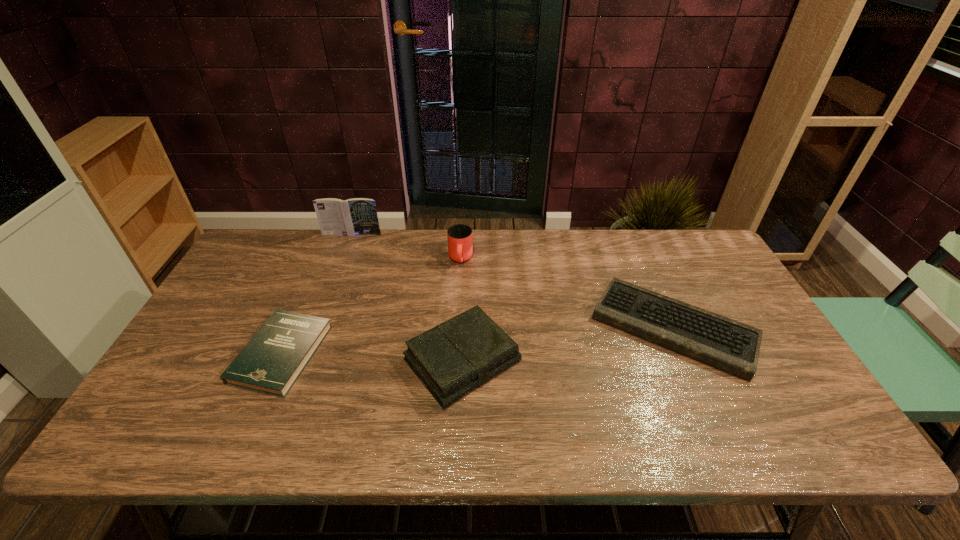
Locate an element on the screen. The width and height of the screenshot is (960, 540). vacant space at the left edge of the desktop is located at coordinates (228, 287).

The height and width of the screenshot is (540, 960). In order to click on free space at the right edge in this screenshot , I will do `click(707, 294)`.

This screenshot has width=960, height=540. Find the location of `vacant point at the far right corner`. vacant point at the far right corner is located at coordinates (713, 251).

Where is `vacant area that lies between the second farthest object and the third shortest object`? This screenshot has height=540, width=960. vacant area that lies between the second farthest object and the third shortest object is located at coordinates (462, 310).

At what (x,y) coordinates should I click in order to perform the action: click on free space between the cup and the shortest object. Please return your answer as a coordinate pair (x, y). The height and width of the screenshot is (540, 960). Looking at the image, I should click on (372, 307).

The image size is (960, 540). I want to click on empty space that is in between the shortest book and the cup, so click(372, 307).

Identify the location of vacant area between the farthest book and the fourth nearest object. This screenshot has width=960, height=540. (406, 247).

You are a GUI agent. You are given a task and a screenshot of the screen. Output one action in this format:
    pyautogui.click(x=<x>, y=<y>)
    Task: Click on the free space between the shortest book and the farthest book
    The image size is (960, 540).
    Given the screenshot: What is the action you would take?
    pyautogui.click(x=317, y=294)

You are a GUI agent. You are given a task and a screenshot of the screen. Output one action in this format:
    pyautogui.click(x=<x>, y=<y>)
    Task: Click on the empty space that is in between the fourth tallest object and the farthest book
    The width and height of the screenshot is (960, 540).
    Given the screenshot: What is the action you would take?
    pyautogui.click(x=513, y=280)

Locate an element on the screen. This screenshot has width=960, height=540. blank region between the fourth shortest object and the fourth tallest object is located at coordinates (567, 293).